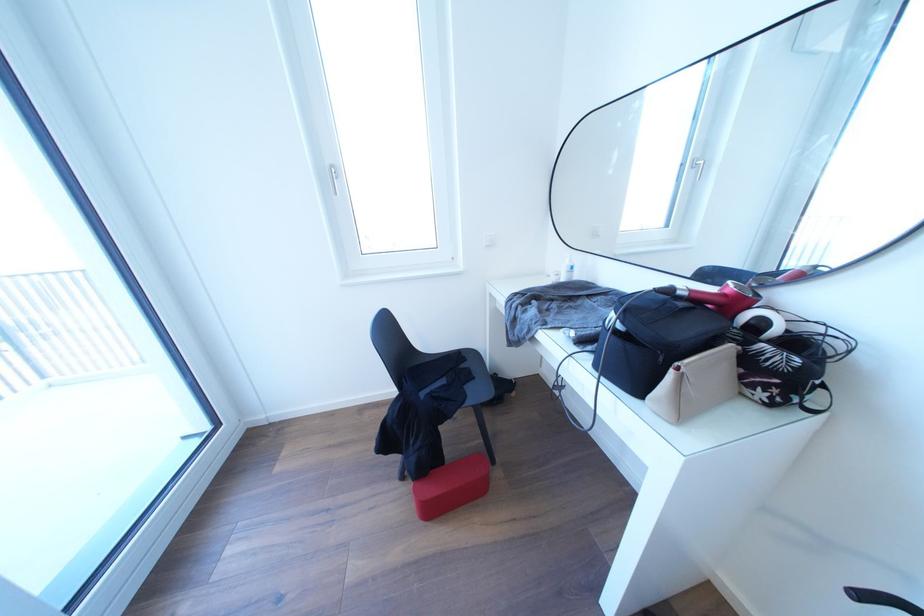
Identify the location of white window handle. (333, 177).